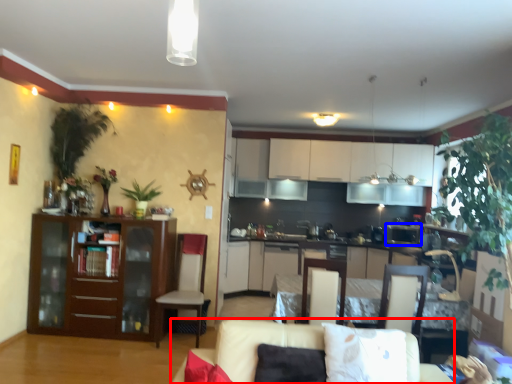
Question: Which object appears farthest to the camera in this image, couch (highlighted by a red box) or appliance (highlighted by a blue box)?

Choices:
 (A) couch
 (B) appliance

Answer: (B)